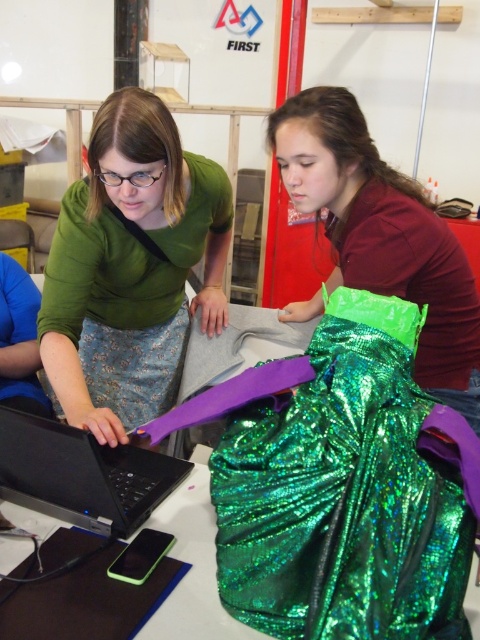
Who is lower down, green sparkly skirt at center or green sequined skirt at center?

green sparkly skirt at center is lower down.

Between green sparkly skirt at center and green sequined skirt at center, which one appears on the right side from the viewer's perspective?

green sequined skirt at center is more to the right.

Is point (81, 225) closer to camera compared to point (326, 112)?

No, it is behind (326, 112).

Locate an element on the screen. green sparkly skirt at center is located at coordinates (131, 268).

Between green sequined skirt at center and black plastic table at center, which one has less height?

black plastic table at center is shorter.

Between point (305, 92) and point (179, 538), which one is positioned behind?

The point (305, 92) is more distant.

I want to click on green sequined skirt at center, so click(383, 234).

Is green sequined skirt at center shorter than black matte laptop at center?

No.

This screenshot has height=640, width=480. What do you see at coordinates (383, 234) in the screenshot? I see `green sequined skirt at center` at bounding box center [383, 234].

Locate an element on the screen. green sequined skirt at center is located at coordinates (383, 234).